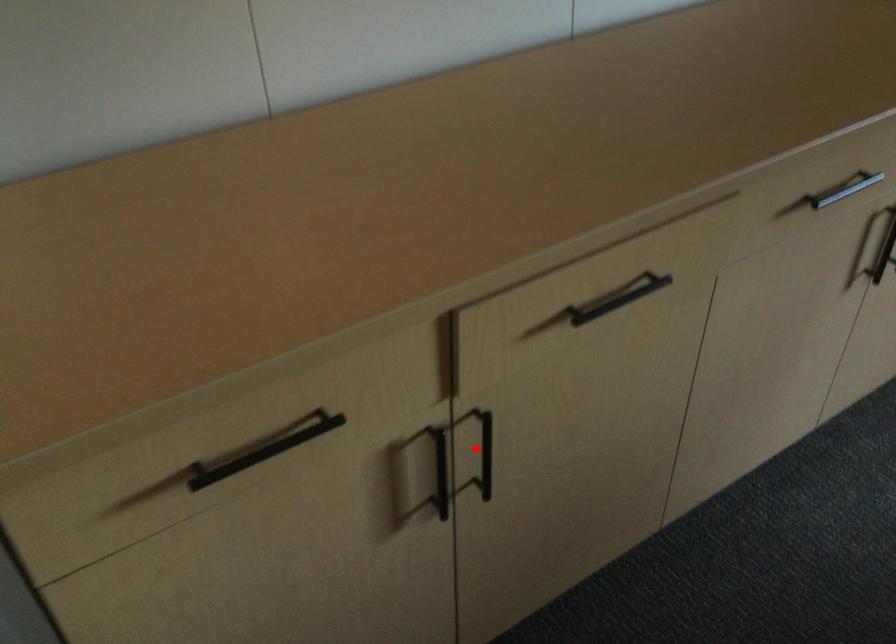
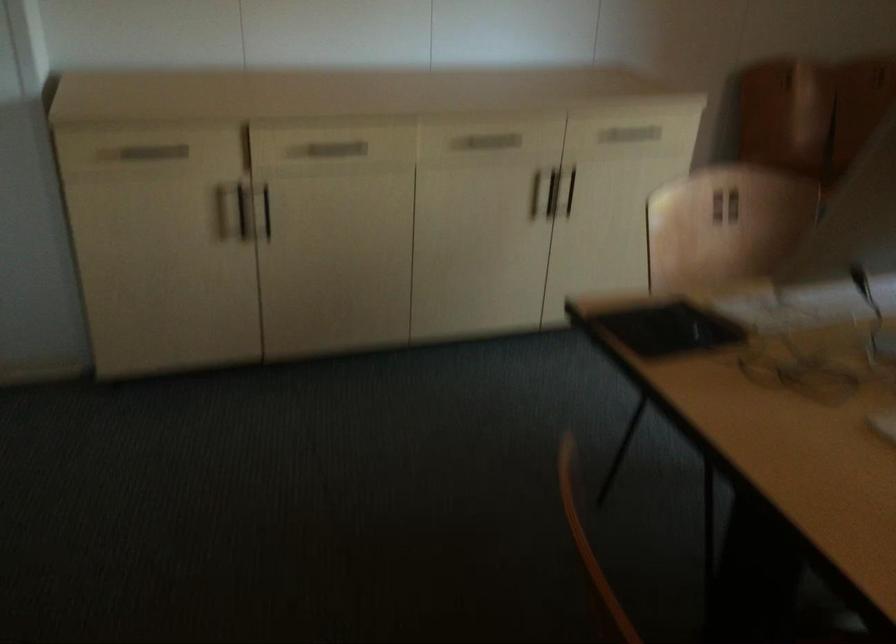
Where in the second image is the point corresponding to the highlighted location from the first image?

(264, 211)